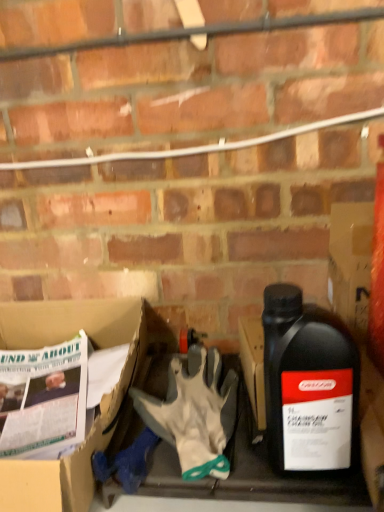
Question: Is white fabric glove at center wider than black plastic bottle at right?

Choices:
 (A) no
 (B) yes

Answer: (B)

Question: Is white fabric glove at center smaller than black plastic bottle at right?

Choices:
 (A) no
 (B) yes

Answer: (B)

Question: From the image's perspective, is white fabric glove at center on top of black plastic bottle at right?

Choices:
 (A) no
 (B) yes

Answer: (A)

Question: From a real-world perspective, is white fabric glove at center beneath black plastic bottle at right?

Choices:
 (A) yes
 (B) no

Answer: (A)

Question: Is white fabric glove at center closer to camera compared to black plastic bottle at right?

Choices:
 (A) yes
 (B) no

Answer: (B)

Question: Do you think white cardboard box at lower left is within white fabric glove at center, or outside of it?

Choices:
 (A) outside
 (B) inside

Answer: (A)

Question: Looking at their shapes, would you say white cardboard box at lower left is wider or thinner than white fabric glove at center?

Choices:
 (A) wide
 (B) thin

Answer: (A)

Question: Is white cardboard box at lower left taller or shorter than white fabric glove at center?

Choices:
 (A) short
 (B) tall

Answer: (B)

Question: Considering the positions of point (6, 308) and point (178, 457), is point (6, 308) closer or farther from the camera than point (178, 457)?

Choices:
 (A) farther
 (B) closer

Answer: (A)

Question: From the image's perspective, relative to white cardboard box at lower left, is black plastic bottle at right above or below?

Choices:
 (A) below
 (B) above

Answer: (B)

Question: From a real-world perspective, is black plastic bottle at right above or below white cardboard box at lower left?

Choices:
 (A) above
 (B) below

Answer: (A)

Question: Is black plastic bottle at right bigger or smaller than white cardboard box at lower left?

Choices:
 (A) small
 (B) big

Answer: (A)

Question: Does point (350, 404) appear closer or farther from the camera than point (6, 342)?

Choices:
 (A) closer
 (B) farther

Answer: (A)

Question: Is white cardboard box at lower left to the left or to the right of black plastic bottle at right in the image?

Choices:
 (A) left
 (B) right

Answer: (A)

Question: Considering the positions of white cardboard box at lower left and black plastic bottle at right in the image, is white cardboard box at lower left wider or thinner than black plastic bottle at right?

Choices:
 (A) thin
 (B) wide

Answer: (B)